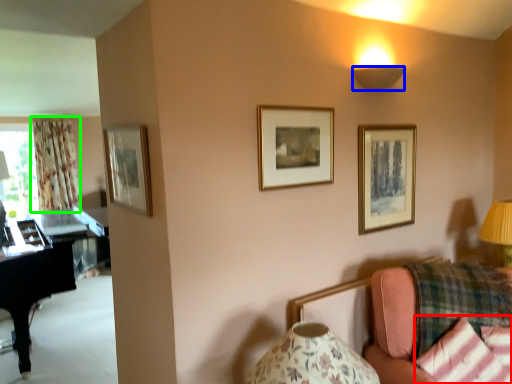
Question: Which object is the closest to the pillow (highlighted by a red box)? Choose among these: lamp (highlighted by a blue box) or curtain (highlighted by a green box).

Choices:
 (A) lamp
 (B) curtain

Answer: (A)